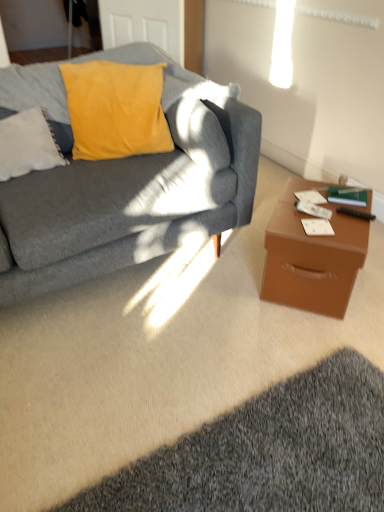
Find the location of a particular element. The width and height of the screenshot is (384, 512). vacant area that lies in front of black plastic remote control at right is located at coordinates (349, 234).